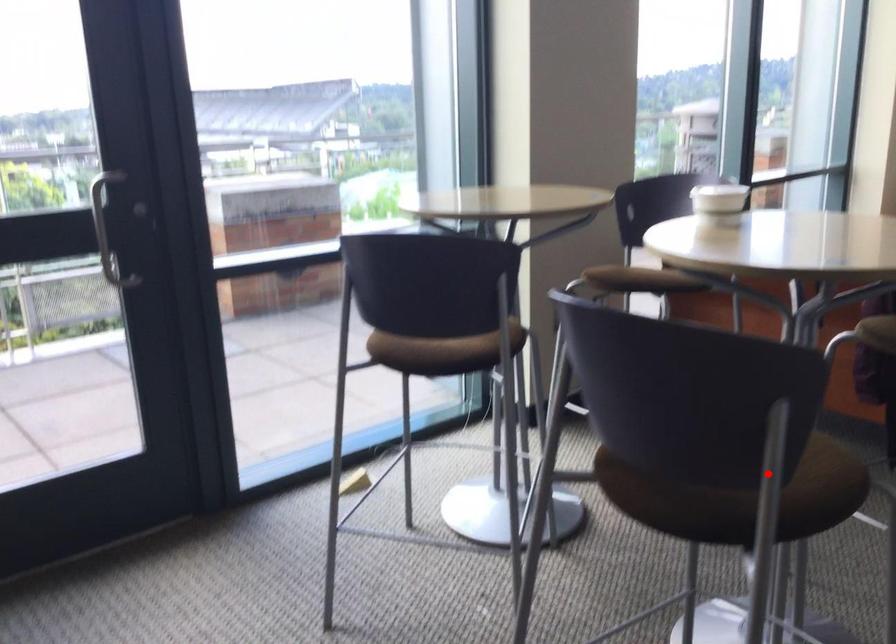
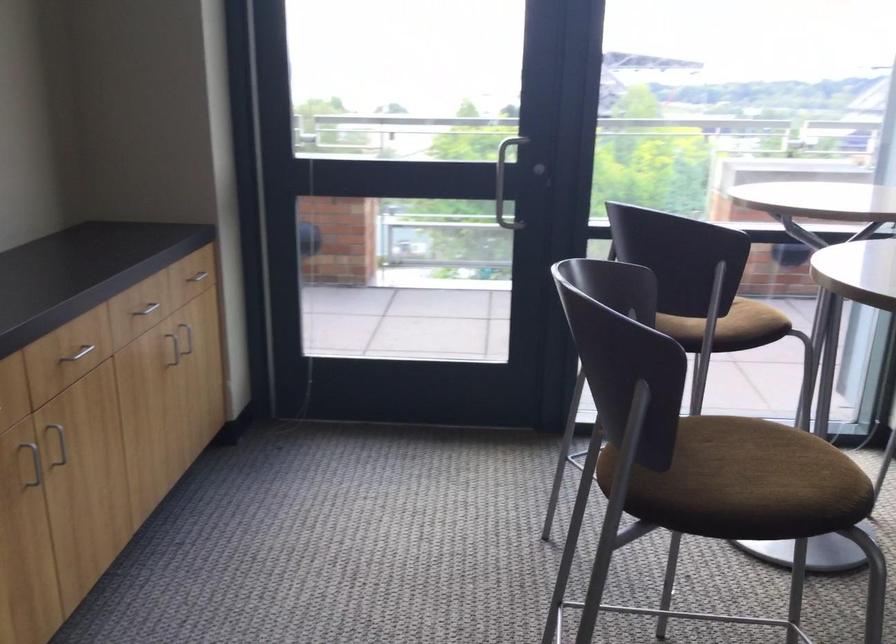
In the second image, find the point that corresponds to the highlighted location in the first image.

(739, 482)